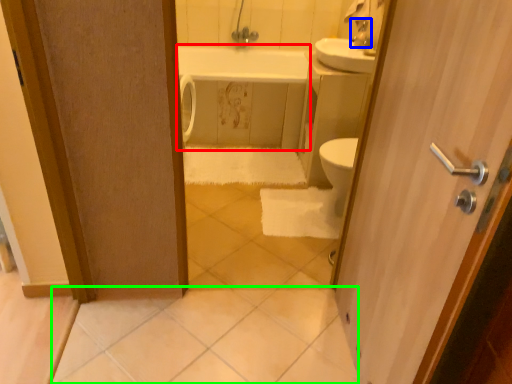
Question: Which object is positioned closest to bath (highlighted by a red box)? Select from faucet (highlighted by a blue box) and tile (highlighted by a green box).

Choices:
 (A) faucet
 (B) tile

Answer: (A)